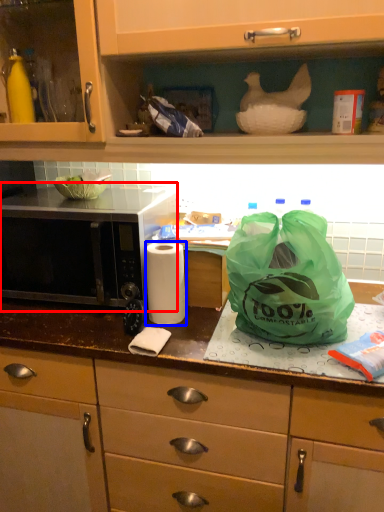
Question: Among these objects, which one is farthest to the camera, microwave (highlighted by a red box) or paper towel (highlighted by a blue box)?

Choices:
 (A) microwave
 (B) paper towel

Answer: (A)